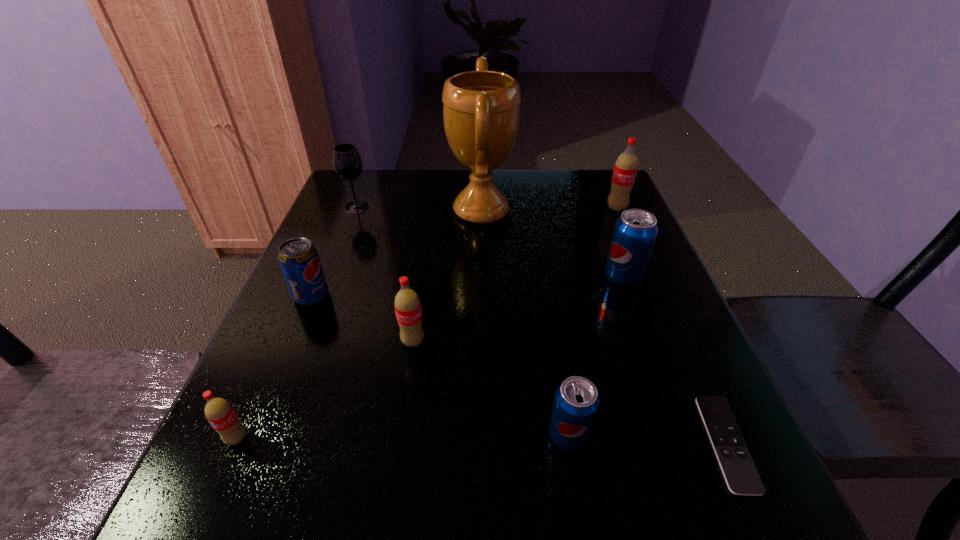
Where is `free region located on the left of the farther blue pop soda`? This screenshot has width=960, height=540. free region located on the left of the farther blue pop soda is located at coordinates (491, 277).

Find the location of `blank area located on the front of the fourth farthest pop soda`. blank area located on the front of the fourth farthest pop soda is located at coordinates (408, 373).

This screenshot has width=960, height=540. Identify the location of vacant space located on the right of the smallest red soda. (468, 438).

Find the location of a particular element. The image size is (960, 540). free space located 0.070m on the left of the third pop soda from right to left is located at coordinates (503, 435).

The width and height of the screenshot is (960, 540). In order to click on vacant point located on the back of the black remote control in this screenshot , I will do coord(666,309).

I want to click on award that is at the far edge, so click(x=481, y=109).

The width and height of the screenshot is (960, 540). Identify the location of soda that is at the far edge. (625, 169).

Identify the location of wineglass located at the far edge. Image resolution: width=960 pixels, height=540 pixels. (347, 163).

This screenshot has height=540, width=960. In order to click on object located in the near edge section of the desktop in this screenshot , I will do `click(742, 478)`.

Where is `wineglass at the left edge`? wineglass at the left edge is located at coordinates (347, 163).